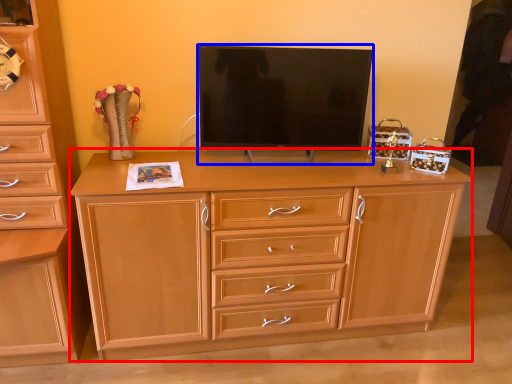
Question: Among these objects, which one is farthest to the camera, chest of drawers (highlighted by a red box) or television (highlighted by a blue box)?

Choices:
 (A) chest of drawers
 (B) television

Answer: (B)